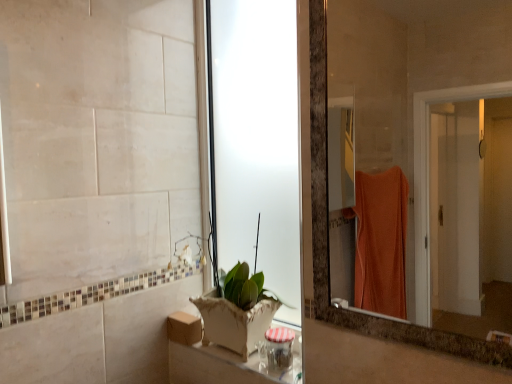
Where is `transparent frosted glass door at center`? transparent frosted glass door at center is located at coordinates (257, 141).

In order to click on white ceramic pot at lower center in this screenshot , I will do `click(238, 310)`.

Locate an element on the screen. Image resolution: width=512 pixels, height=384 pixels. transparent frosted glass door at center is located at coordinates (257, 141).

Based on the photo, considering the sizes of white ceramic pot at lower center and transparent frosted glass door at center in the image, is white ceramic pot at lower center bigger or smaller than transparent frosted glass door at center?

white ceramic pot at lower center is bigger than transparent frosted glass door at center.

Considering the relative sizes of white ceramic pot at lower center and transparent frosted glass door at center in the image provided, is white ceramic pot at lower center wider than transparent frosted glass door at center?

Yes, white ceramic pot at lower center is wider than transparent frosted glass door at center.

From a real-world perspective, is white ceramic pot at lower center positioned above or below transparent frosted glass door at center?

white ceramic pot at lower center is situated lower than transparent frosted glass door at center in the real world.

How much distance is there between white ceramic pot at lower center and matte glass mirror at right?

white ceramic pot at lower center and matte glass mirror at right are 1.69 meters apart.

Can you tell me how much white ceramic pot at lower center and matte glass mirror at right differ in facing direction?

They differ by 0.763 degrees in their facing directions.

In the scene shown: From the image's perspective, relative to matte glass mirror at right, is white ceramic pot at lower center above or below?

white ceramic pot at lower center is situated lower than matte glass mirror at right in the image.

Is white ceramic pot at lower center next to matte glass mirror at right and touching it?

white ceramic pot at lower center and matte glass mirror at right are clearly separated.

Locate an element on the screen. mirror on the right of white ceramic pot at lower center is located at coordinates (410, 73).

From a real-world perspective, is matte glass mirror at right located higher than white ceramic pot at lower center?

Yes, from a real-world perspective, matte glass mirror at right is over white ceramic pot at lower center

Is the position of matte glass mirror at right less distant than that of white ceramic pot at lower center?

Yes, it is.

Does matte glass mirror at right contain white ceramic pot at lower center?

That's incorrect, white ceramic pot at lower center is not inside matte glass mirror at right.

Relative to white ceramic pot at lower center, is wooden box at lower center in front or behind?

→ wooden box at lower center is positioned farther from the viewer than white ceramic pot at lower center.

Looking at the image, does wooden box at lower center seem bigger or smaller compared to white ceramic pot at lower center?

Considering their sizes, wooden box at lower center takes up less space than white ceramic pot at lower center.

From the image's perspective, does wooden box at lower center appear higher than white ceramic pot at lower center?

Actually, wooden box at lower center appears below white ceramic pot at lower center in the image.

Can white ceramic pot at lower center be found inside wooden box at lower center?

No.

From the image's perspective, is matte glass mirror at right located above or below wooden box at lower center?

matte glass mirror at right is situated higher than wooden box at lower center in the image.

From a real-world perspective, is matte glass mirror at right positioned over wooden box at lower center based on gravity?

Yes, from a real-world perspective, matte glass mirror at right is on top of wooden box at lower center.

Is matte glass mirror at right next to wooden box at lower center and touching it?

matte glass mirror at right and wooden box at lower center are not in contact.

Is matte glass mirror at right positioned behind wooden box at lower center?

No, matte glass mirror at right is in front of wooden box at lower center.

From a real-world perspective, is white ceramic pot at lower center over wooden box at lower center?

Yes.

Which is correct: white ceramic pot at lower center is inside wooden box at lower center, or outside of it?

white ceramic pot at lower center exists outside the volume of wooden box at lower center.

From the image's perspective, is white ceramic pot at lower center above or below wooden box at lower center?

white ceramic pot at lower center is above wooden box at lower center.

Is wooden box at lower center taller or shorter than matte glass mirror at right?

wooden box at lower center is shorter than matte glass mirror at right.

Could you tell me if wooden box at lower center is facing matte glass mirror at right?

No, wooden box at lower center is not turned towards matte glass mirror at right.

Find the location of `mirror on the right of wooden box at lower center`. mirror on the right of wooden box at lower center is located at coordinates click(x=410, y=73).

From a real-world perspective, is wooden box at lower center on matte glass mirror at right?

Incorrect, from a real-world perspective, wooden box at lower center is lower than matte glass mirror at right.

Locate an element on the screen. The image size is (512, 384). glass door above the white ceramic pot at lower center (from a real-world perspective) is located at coordinates (257, 141).

Where is `houseplant beneath the matte glass mirror at right (from a real-world perspective)`? This screenshot has height=384, width=512. houseplant beneath the matte glass mirror at right (from a real-world perspective) is located at coordinates (238, 310).

Based on their spatial positions, is white ceramic pot at lower center or matte glass mirror at right closer to transparent frosted glass door at center?

The object closer to transparent frosted glass door at center is white ceramic pot at lower center.

Considering their positions, is wooden box at lower center positioned closer to matte glass mirror at right than white ceramic pot at lower center?

Among the two, white ceramic pot at lower center is located nearer to matte glass mirror at right.

When comparing their distances from matte glass mirror at right, does transparent frosted glass door at center or white ceramic pot at lower center seem further?

Based on the image, white ceramic pot at lower center appears to be further to matte glass mirror at right.

From the image, which object appears to be nearer to matte glass mirror at right, white ceramic pot at lower center or wooden box at lower center?

white ceramic pot at lower center is closer to matte glass mirror at right.

Looking at the image, which one is located closer to transparent frosted glass door at center, wooden box at lower center or matte glass mirror at right?

Based on the image, wooden box at lower center appears to be nearer to transparent frosted glass door at center.

Looking at this image, looking at the image, which one is located closer to wooden box at lower center, white ceramic pot at lower center or transparent frosted glass door at center?

white ceramic pot at lower center is positioned closer to the anchor wooden box at lower center.

Which object lies further to the anchor point white ceramic pot at lower center, transparent frosted glass door at center or matte glass mirror at right?

matte glass mirror at right.

When comparing their distances from white ceramic pot at lower center, does matte glass mirror at right or wooden box at lower center seem closer?

wooden box at lower center is closer to white ceramic pot at lower center.

I want to click on houseplant that lies between transparent frosted glass door at center and wooden box at lower center from top to bottom, so click(x=238, y=310).

Locate an element on the screen. This screenshot has height=384, width=512. houseplant between matte glass mirror at right and transparent frosted glass door at center in the front-back direction is located at coordinates (238, 310).

Find the location of `houseplant positioned between matte glass mirror at right and wooden box at lower center from near to far`. houseplant positioned between matte glass mirror at right and wooden box at lower center from near to far is located at coordinates (238, 310).

Identify the location of glass door between matte glass mirror at right and wooden box at lower center along the z-axis. This screenshot has height=384, width=512. (257, 141).